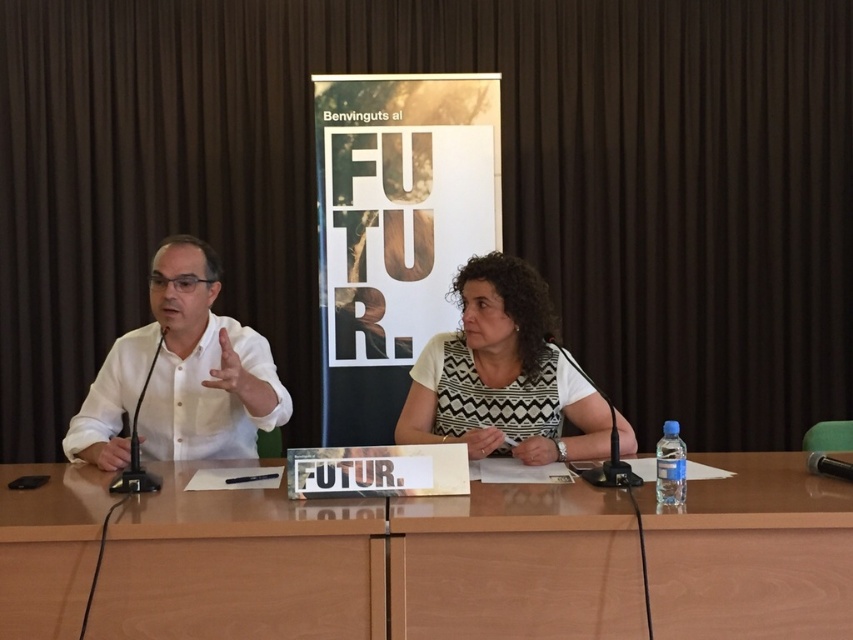
Question: Which object is positioned farthest from the white shirt at left?

Choices:
 (A) white dotted dress at center
 (B) wooden table at center

Answer: (A)

Question: Where is wooden table at center located in relation to white dotted dress at center in the image?

Choices:
 (A) below
 (B) above

Answer: (A)

Question: Is wooden table at center further to the viewer compared to white shirt at left?

Choices:
 (A) yes
 (B) no

Answer: (B)

Question: Estimate the real-world distances between objects in this image. Which object is closer to the white shirt at left?

Choices:
 (A) wooden table at center
 (B) white dotted dress at center

Answer: (A)

Question: Is white shirt at left to the right of white dotted dress at center from the viewer's perspective?

Choices:
 (A) no
 (B) yes

Answer: (A)

Question: Which of the following is the farthest from the observer?

Choices:
 (A) (120, 381)
 (B) (750, 614)
 (C) (546, 458)

Answer: (A)